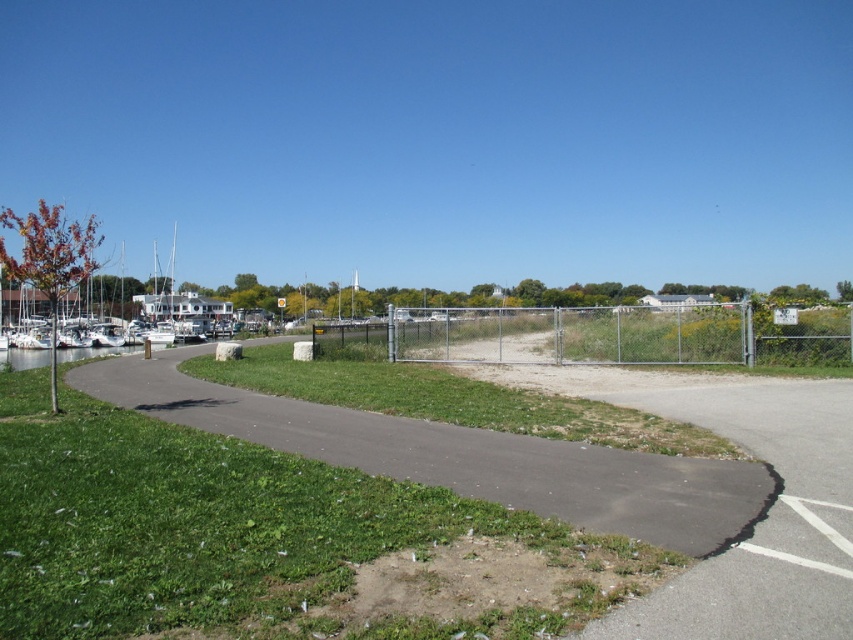
Can you confirm if gravel path at center is bigger than metallic chain-link fence at center?

Incorrect, gravel path at center is not larger than metallic chain-link fence at center.

Does gravel path at center have a greater width compared to metallic chain-link fence at center?

Incorrect, gravel path at center's width does not surpass metallic chain-link fence at center's.

Which is behind, point (379, 428) or point (683, 321)?

Point (683, 321)

You are a GUI agent. You are given a task and a screenshot of the screen. Output one action in this format:
    pyautogui.click(x=<x>, y=<y>)
    Task: Click on the gravel path at center
    This screenshot has width=853, height=640.
    Given the screenshot: What is the action you would take?
    pyautogui.click(x=460, y=456)